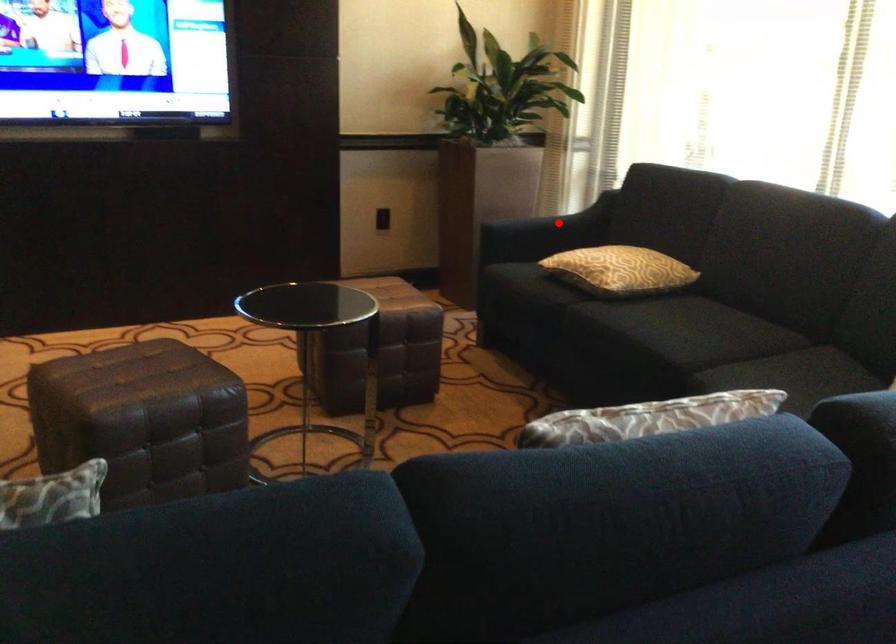
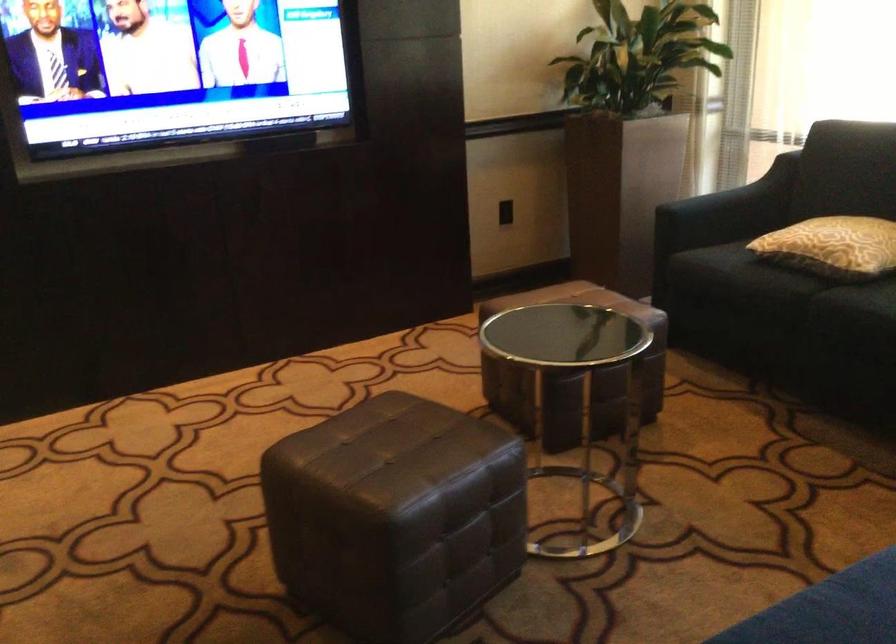
Question: I am providing you with two images of the same scene from different viewpoints. A red point is shown in image1. For the corresponding object point in image2, is it positioned nearer or farther from the camera?

Choices:
 (A) Nearer
 (B) Farther

Answer: (A)